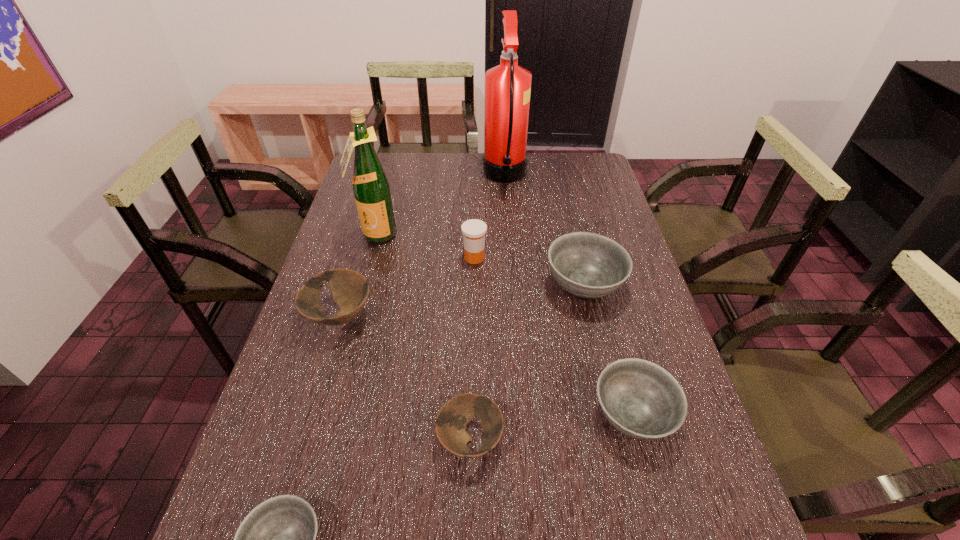
The height and width of the screenshot is (540, 960). I want to click on object located in the far edge section of the desktop, so click(x=507, y=86).

The height and width of the screenshot is (540, 960). I want to click on liquor situated at the left edge, so click(371, 188).

The height and width of the screenshot is (540, 960). Identify the location of bowl present at the left edge. (350, 290).

Where is `blank space at the far edge`? This screenshot has height=540, width=960. blank space at the far edge is located at coordinates (526, 184).

The image size is (960, 540). I want to click on vacant space at the left edge of the desktop, so click(x=312, y=481).

In the image, there is a desktop. At what (x,y) coordinates should I click in order to perform the action: click on vacant space at the right edge. Please return your answer as a coordinate pair (x, y). The image size is (960, 540). Looking at the image, I should click on pos(645,454).

The width and height of the screenshot is (960, 540). Find the location of `unoccupied position between the second biggest gray bowl and the right brown bowl`. unoccupied position between the second biggest gray bowl and the right brown bowl is located at coordinates (551, 428).

Identify the location of unoccupied position between the nearer brown bowl and the second nearest gray bowl. Image resolution: width=960 pixels, height=540 pixels. (551, 428).

Find the location of a particular element. vacant space that's between the second biggest gray bowl and the orange medicine is located at coordinates (553, 336).

In order to click on free spot between the third bowl from left to right and the liquor in this screenshot , I will do `click(423, 338)`.